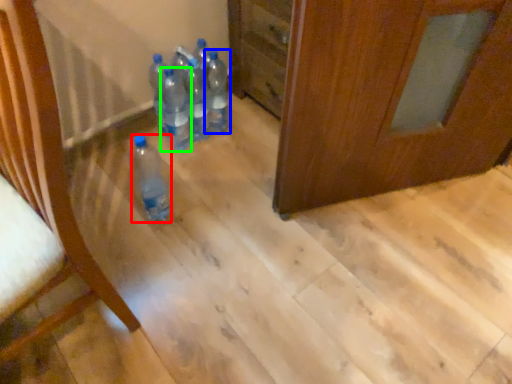
Question: Considering the real-world distances, which object is closest to bottle (highlighted by a red box)? bottle (highlighted by a blue box) or bottle (highlighted by a green box).

Choices:
 (A) bottle
 (B) bottle

Answer: (B)